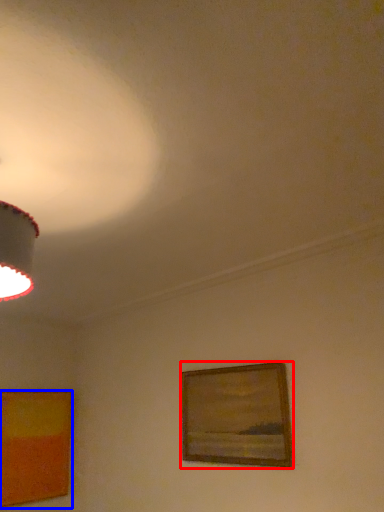
Question: Which of the following is the closest to the observer, picture frame (highlighted by a red box) or picture frame (highlighted by a blue box)?

Choices:
 (A) picture frame
 (B) picture frame

Answer: (A)